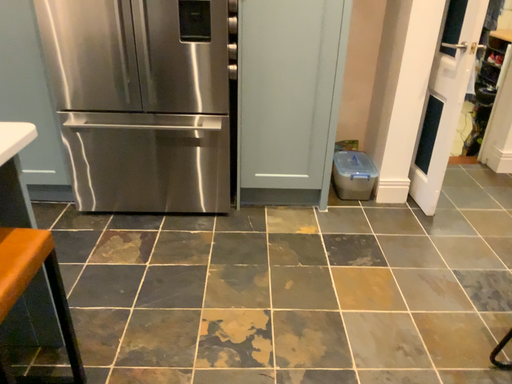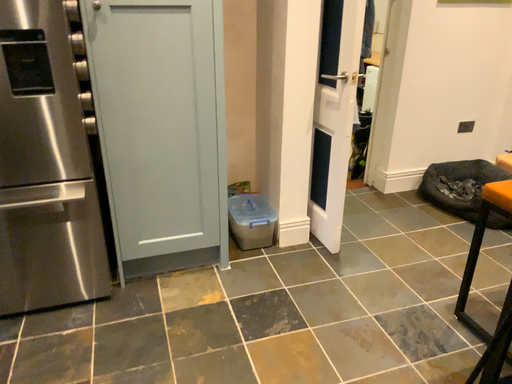
Question: How did the camera likely rotate when shooting the video?

Choices:
 (A) rotated right
 (B) rotated left

Answer: (A)